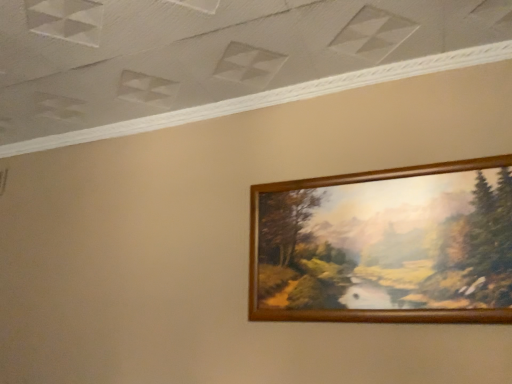
Image resolution: width=512 pixels, height=384 pixels. Find the location of `wooden picture frame at upper right`. wooden picture frame at upper right is located at coordinates (385, 246).

This screenshot has width=512, height=384. What do you see at coordinates (385, 246) in the screenshot?
I see `wooden picture frame at upper right` at bounding box center [385, 246].

Locate an element on the screen. The image size is (512, 384). wooden picture frame at upper right is located at coordinates (385, 246).